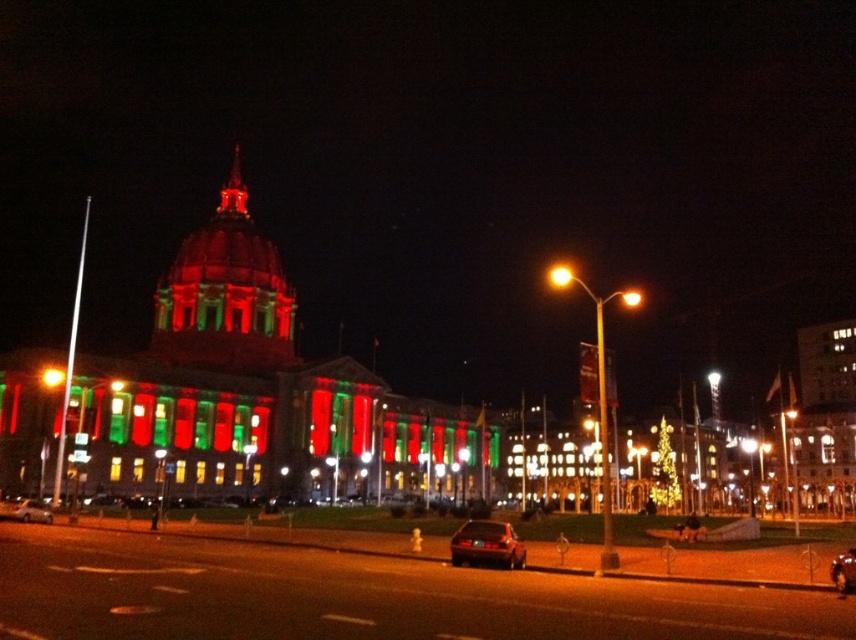
Question: In this image, where is metallic silver car at center located relative to shiny metallic car at center?

Choices:
 (A) left
 (B) right

Answer: (A)

Question: Does metallic silver car at center appear over shiny metallic car at center?

Choices:
 (A) no
 (B) yes

Answer: (B)

Question: Among these points, which one is nearest to the camera?

Choices:
 (A) (453, 540)
 (B) (45, 515)
 (C) (836, 557)

Answer: (A)

Question: Can you confirm if shiny black sedan at lower center is positioned above metallic silver car at center?

Choices:
 (A) no
 (B) yes

Answer: (A)

Question: Estimate the real-world distances between objects in this image. Which object is farther from the metallic silver car at center?

Choices:
 (A) shiny metallic car at center
 (B) shiny black sedan at lower center

Answer: (A)

Question: Which object is the closest to the shiny black sedan at lower center?

Choices:
 (A) shiny metallic car at center
 (B) metallic silver car at center

Answer: (A)